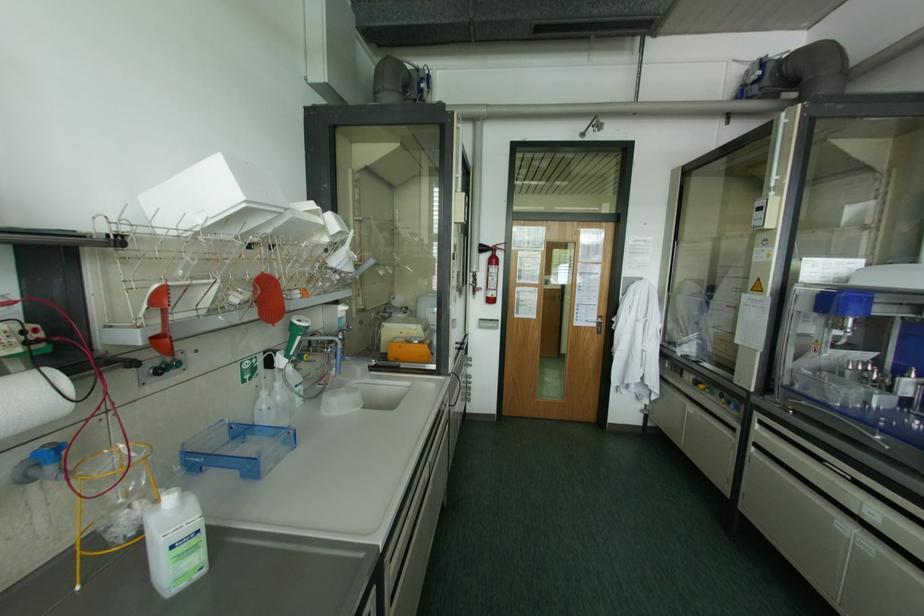
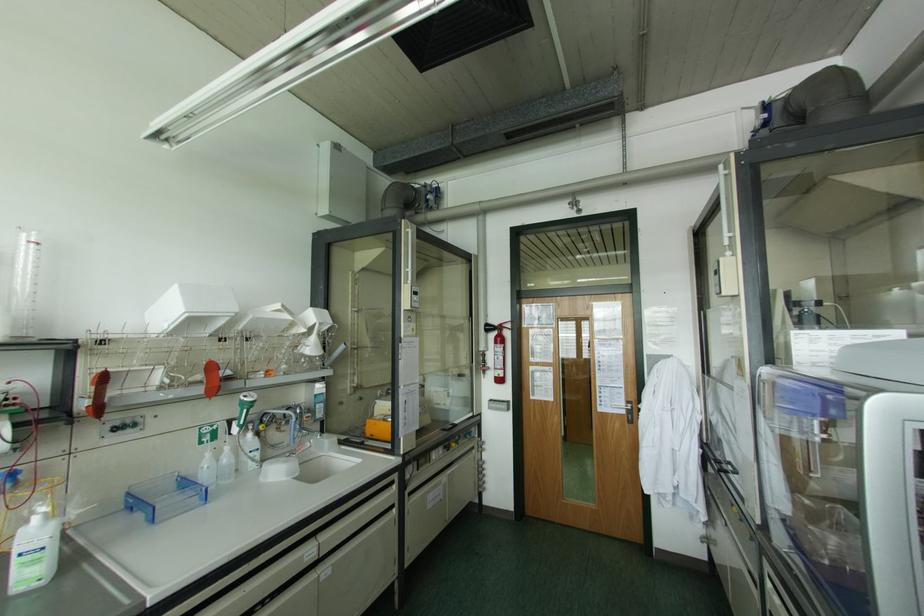
The point at (190, 499) is marked in the first image. Where is the corresponding point in the second image?

(53, 523)